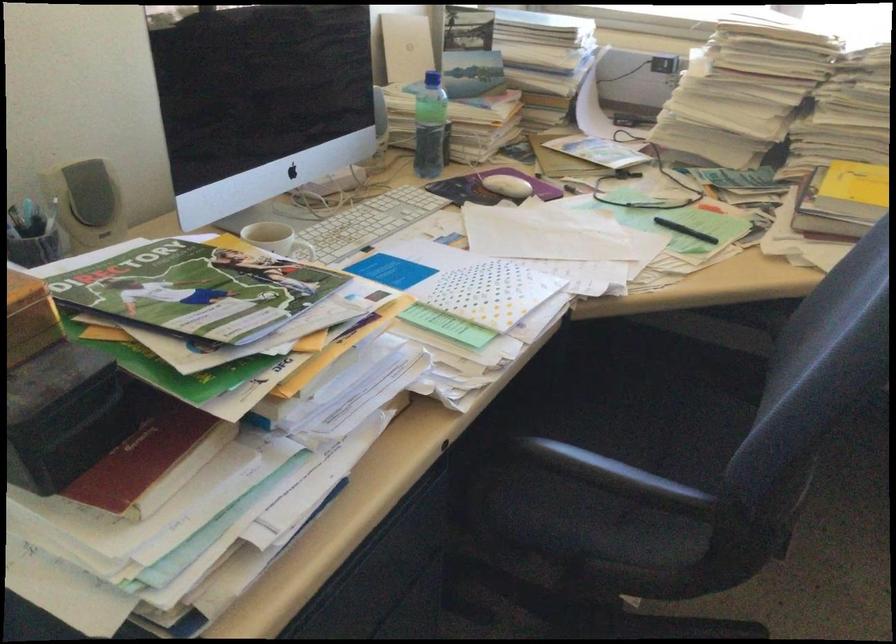
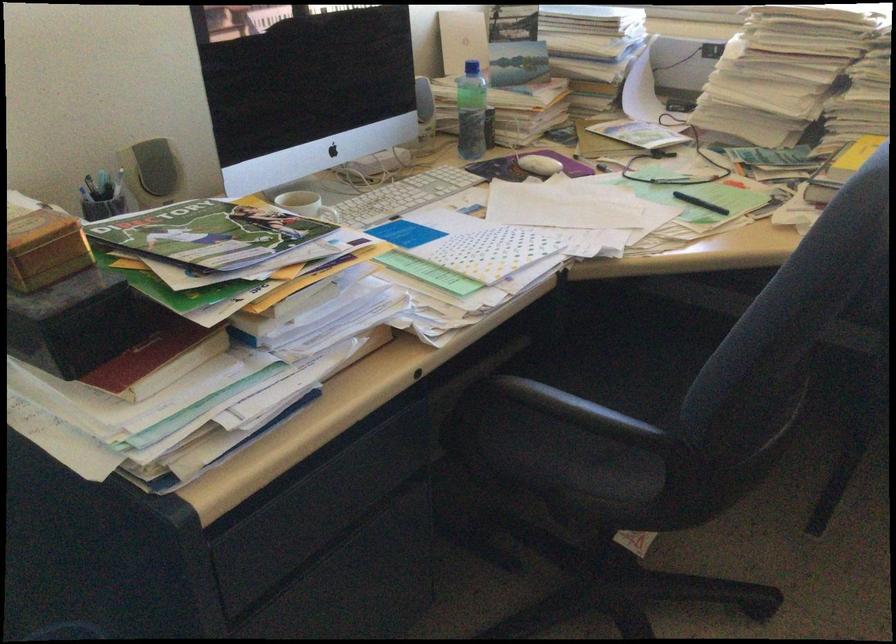
The point at (684, 234) is marked in the first image. Where is the corresponding point in the second image?

(700, 203)